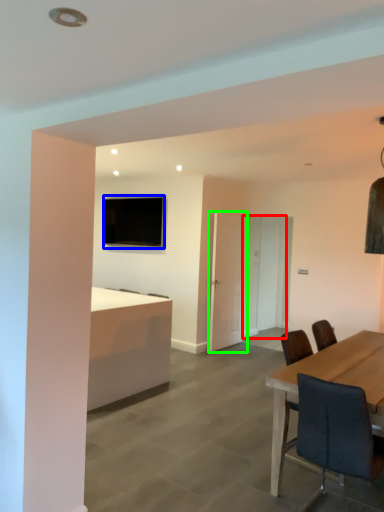
Question: Which object is the farthest from glass door (highlighted by a red box)? Choose among these: television (highlighted by a blue box) or glass door (highlighted by a green box).

Choices:
 (A) television
 (B) glass door

Answer: (A)